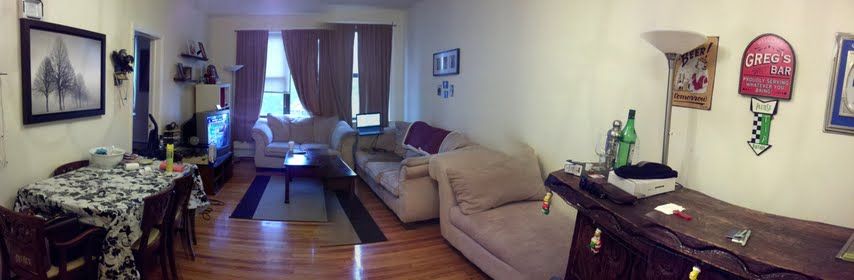
Locate an element on the screen. The height and width of the screenshot is (280, 854). doorway is located at coordinates (150, 77).